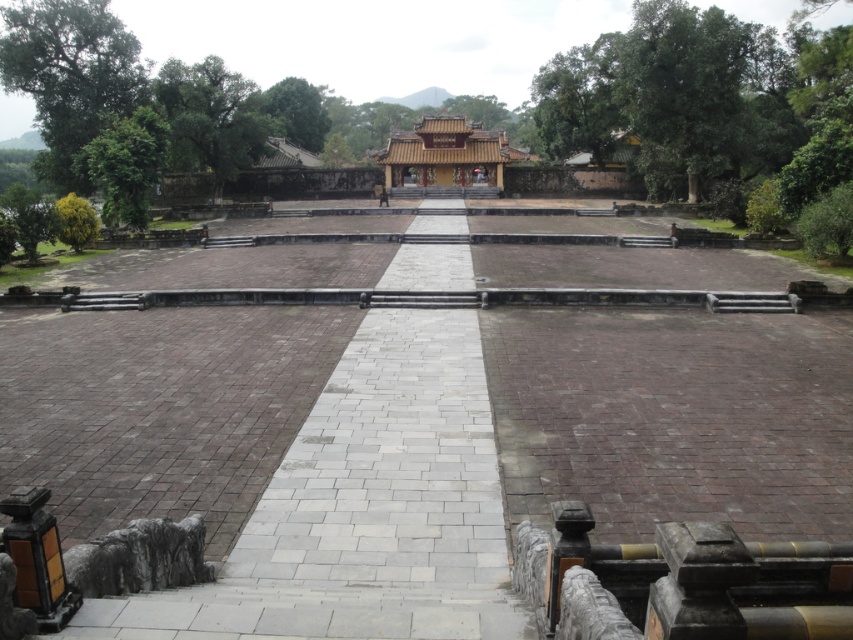
Question: Among these objects, which one is nearest to the camera?

Choices:
 (A) gray stone path at center
 (B) golden lacquered palace at center

Answer: (A)

Question: Can you confirm if gray stone path at center is thinner than golden lacquered palace at center?

Choices:
 (A) yes
 (B) no

Answer: (A)

Question: Is gray stone path at center further to camera compared to golden lacquered palace at center?

Choices:
 (A) no
 (B) yes

Answer: (A)

Question: Does gray stone path at center have a greater width compared to golden lacquered palace at center?

Choices:
 (A) no
 (B) yes

Answer: (A)

Question: Which object appears farthest from the camera in this image?

Choices:
 (A) golden lacquered palace at center
 (B) gray stone path at center

Answer: (A)